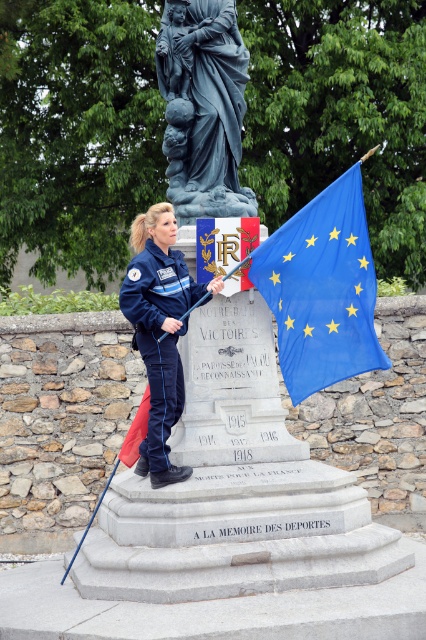
Can you confirm if blue stone statue at upper center is positioned to the right of navy blue fabric uniform at center?

Indeed, blue stone statue at upper center is positioned on the right side of navy blue fabric uniform at center.

Measure the distance from blue stone statue at upper center to navy blue fabric uniform at center.

They are 2.85 meters apart.

Image resolution: width=426 pixels, height=640 pixels. Identify the location of blue stone statue at upper center. (203, 106).

The height and width of the screenshot is (640, 426). I want to click on blue stone statue at upper center, so click(x=203, y=106).

Who is positioned more to the left, blue fabric flag at right or navy blue fabric uniform at center?

From the viewer's perspective, navy blue fabric uniform at center appears more on the left side.

Which is in front, point (344, 211) or point (143, 442)?

Point (143, 442) is more forward.

Identify the location of blue fabric flag at right. (322, 289).

Based on the photo, who is higher up, blue fabric flag at right or blue stone statue at upper center?

blue stone statue at upper center is above.

Is blue fabric flag at right positioned behind blue stone statue at upper center?

No, blue fabric flag at right is closer to the viewer.

Which is in front, point (287, 275) or point (201, 148)?

Point (287, 275) is more forward.

You are a GUI agent. You are given a task and a screenshot of the screen. Output one action in this format:
    pyautogui.click(x=<x>, y=<y>)
    Task: Click on the blue fabric flag at right
    The width and height of the screenshot is (426, 640).
    Given the screenshot: What is the action you would take?
    pyautogui.click(x=322, y=289)